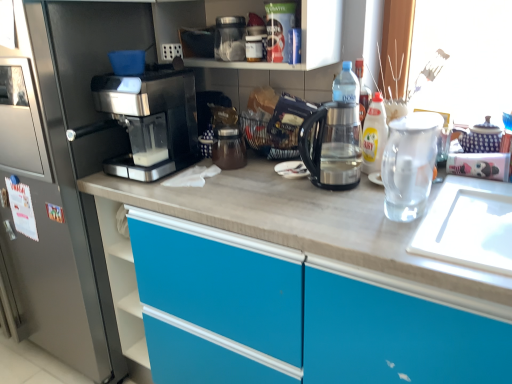
Question: Can you confirm if yellow glossy bottle at upper right is positioned to the left of transparent plastic kettle at center?

Choices:
 (A) yes
 (B) no

Answer: (B)

Question: Can you confirm if yellow glossy bottle at upper right is shorter than transparent plastic kettle at center?

Choices:
 (A) yes
 (B) no

Answer: (B)

Question: Is the position of yellow glossy bottle at upper right more distant than that of transparent plastic kettle at center?

Choices:
 (A) yes
 (B) no

Answer: (A)

Question: Is yellow glossy bottle at upper right aimed at transparent plastic kettle at center?

Choices:
 (A) no
 (B) yes

Answer: (B)

Question: Is yellow glossy bottle at upper right to the right of transparent plastic kettle at center from the viewer's perspective?

Choices:
 (A) yes
 (B) no

Answer: (A)

Question: Considering their positions, is sleek metallic coffee maker at left located in front of or behind transparent plastic kettle at center?

Choices:
 (A) behind
 (B) front

Answer: (A)

Question: In terms of width, does sleek metallic coffee maker at left look wider or thinner when compared to transparent plastic kettle at center?

Choices:
 (A) wide
 (B) thin

Answer: (A)

Question: Is sleek metallic coffee maker at left to the left or to the right of transparent plastic kettle at center in the image?

Choices:
 (A) left
 (B) right

Answer: (A)

Question: Considering the positions of point (177, 110) and point (346, 187), is point (177, 110) closer or farther from the camera than point (346, 187)?

Choices:
 (A) farther
 (B) closer

Answer: (A)

Question: From a real-world perspective, is transparent plastic kettle at center above or below yellow glossy bottle at upper right?

Choices:
 (A) above
 (B) below

Answer: (A)

Question: From the image's perspective, is transparent plastic kettle at center located above or below yellow glossy bottle at upper right?

Choices:
 (A) above
 (B) below

Answer: (B)

Question: Based on their sizes in the image, would you say transparent plastic kettle at center is bigger or smaller than yellow glossy bottle at upper right?

Choices:
 (A) big
 (B) small

Answer: (A)

Question: Looking at their shapes, would you say transparent plastic kettle at center is wider or thinner than yellow glossy bottle at upper right?

Choices:
 (A) thin
 (B) wide

Answer: (B)

Question: From a real-world perspective, is sleek black coffee machine at left above or below transparent plastic kettle at center?

Choices:
 (A) above
 (B) below

Answer: (B)

Question: Based on their sizes in the image, would you say sleek black coffee machine at left is bigger or smaller than transparent plastic kettle at center?

Choices:
 (A) small
 (B) big

Answer: (B)